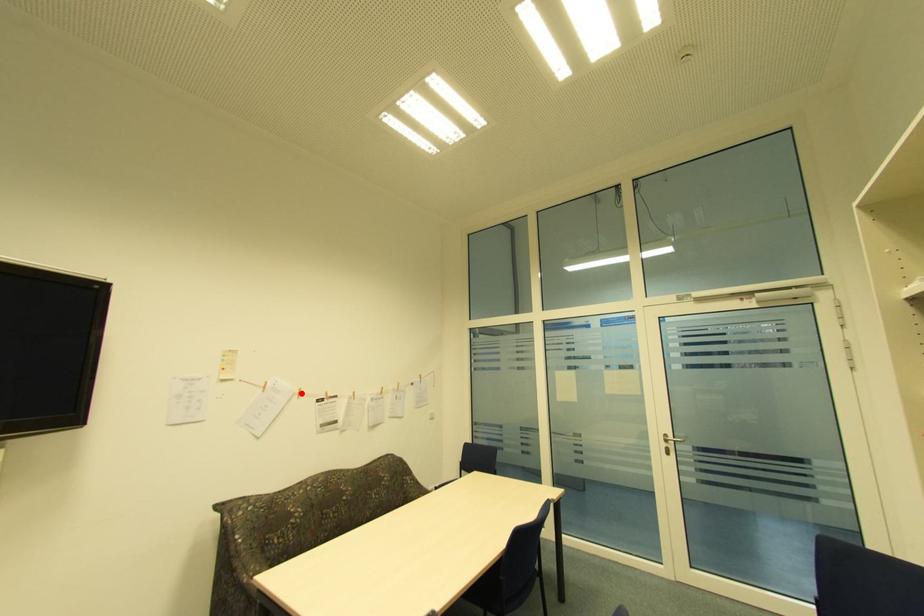
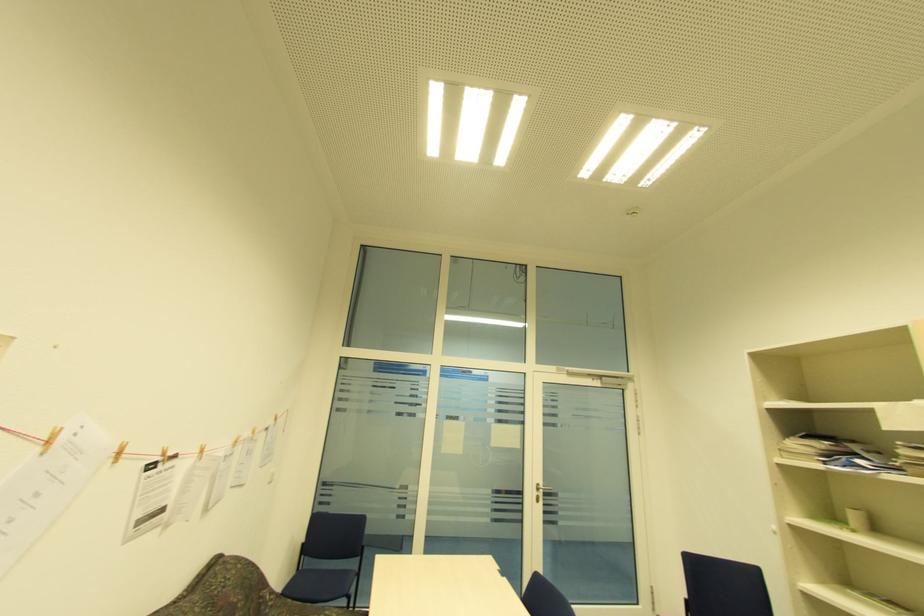
The point at the highlighted location is marked in the first image. Where is the corresponding point in the second image?

(120, 454)